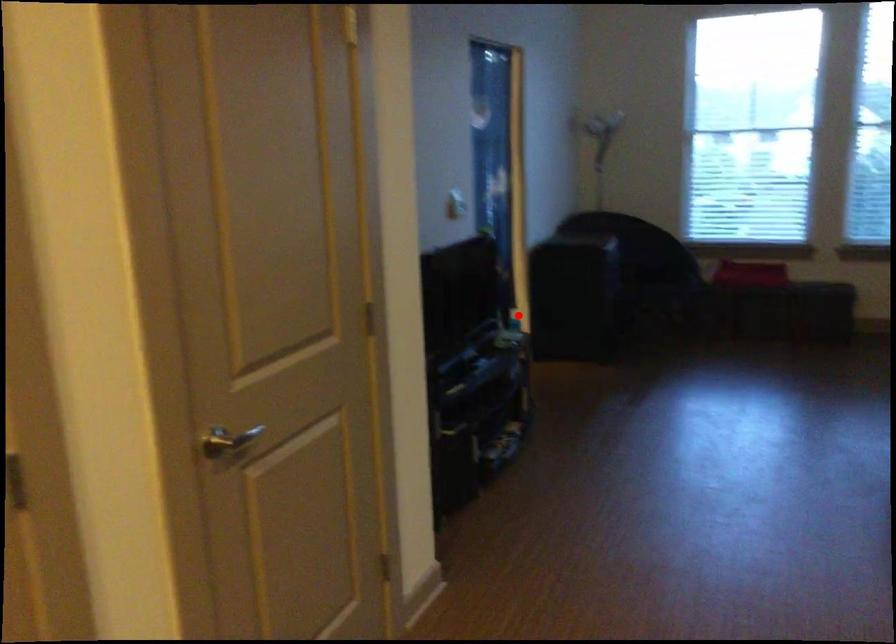
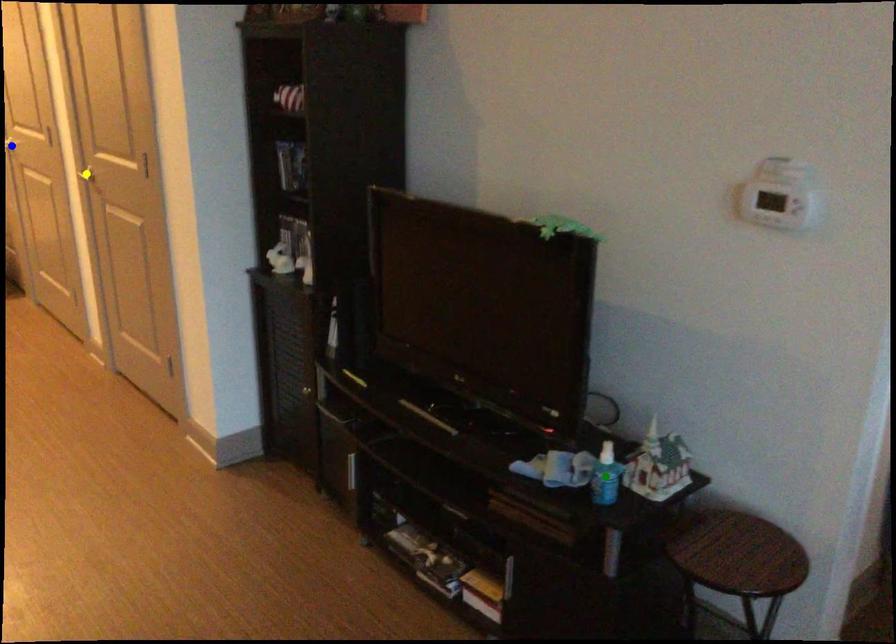
Question: I am providing you with two images of the same scene from different viewpoints. A red point is marked on the first image. You are given multiple points on the second image. In image 2, which mark is for the same physical point as the one in image 1?

Choices:
 (A) yellow point
 (B) green point
 (C) blue point

Answer: (B)